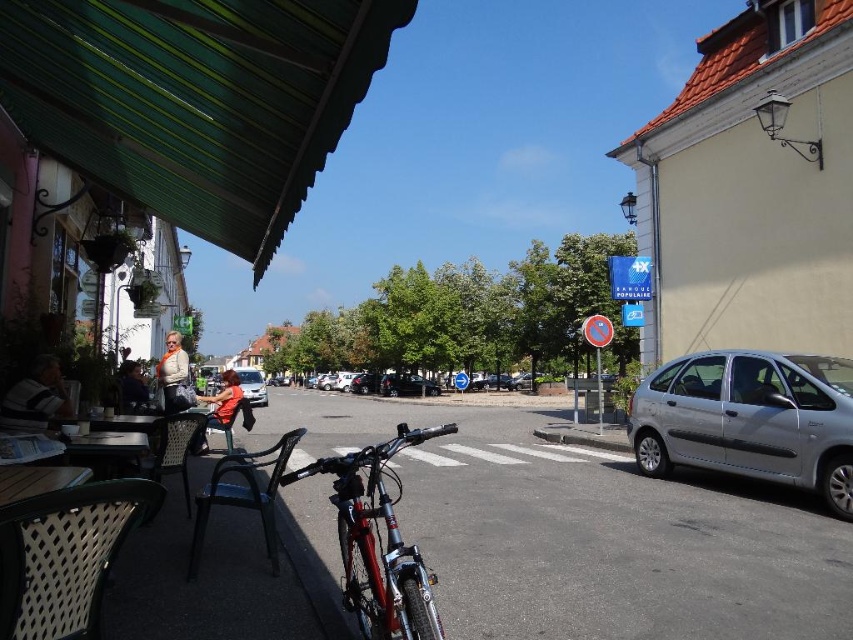
Can you confirm if orange fabric shirt at center is positioned to the left of orange scarf at center?

Indeed, orange fabric shirt at center is positioned on the left side of orange scarf at center.

What do you see at coordinates (223, 401) in the screenshot? I see `orange fabric shirt at center` at bounding box center [223, 401].

Find the location of `orange fabric shirt at center`. orange fabric shirt at center is located at coordinates (223, 401).

Between point (225, 184) and point (379, 513), which one is positioned in front?

Point (379, 513)

Between green corrugated metal awning at upper left and shiny metallic bicycle at center, which one appears on the left side from the viewer's perspective?

shiny metallic bicycle at center

Does point (183, 8) lie behind point (428, 628)?

Yes.

Locate an element on the screen. The width and height of the screenshot is (853, 640). green corrugated metal awning at upper left is located at coordinates (195, 99).

Is point (747, 456) positioned after point (6, 420)?

Yes.

In the scene shown: Who is more distant from viewer, (654,376) or (45,412)?

Point (654,376)

Who is more forward, (813, 394) or (45, 384)?

Point (45, 384) is in front.

Identify the location of silver metallic hatchback at right. The height and width of the screenshot is (640, 853). (750, 419).